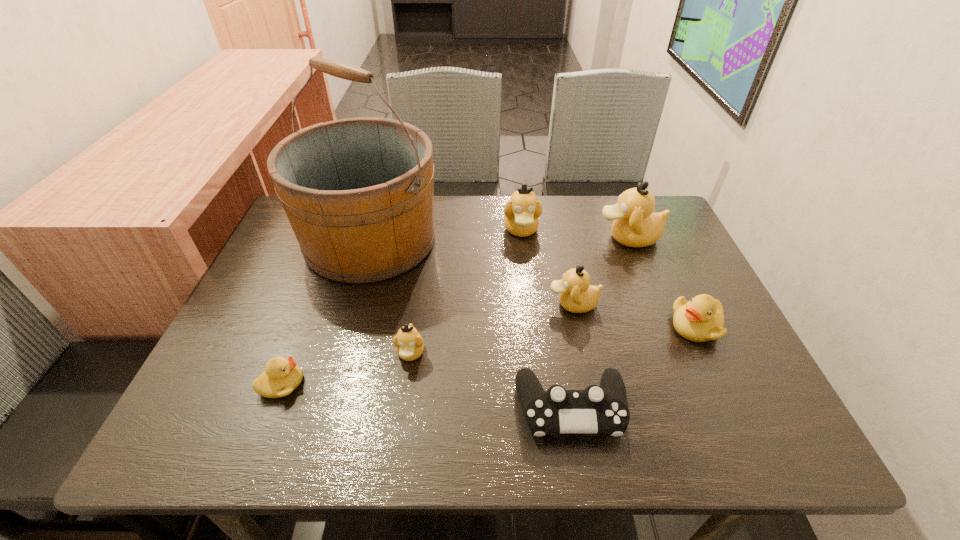
Where is `duckling that can be found as the second closest to the bigger yellow duckling`? The height and width of the screenshot is (540, 960). duckling that can be found as the second closest to the bigger yellow duckling is located at coordinates (635, 224).

Select which tan duckling appears as the closest to the second duckling from left to right. Please provide its 2D coordinates. Your answer should be formatted as a tuple, i.e. [(x, y)], where the tuple contains the x and y coordinates of a point satisfying the conditions above.

[(577, 295)]

Select which tan duckling is the fourth closest to the bigger yellow duckling. Please provide its 2D coordinates. Your answer should be formatted as a tuple, i.e. [(x, y)], where the tuple contains the x and y coordinates of a point satisfying the conditions above.

[(409, 344)]

Locate an element on the screen. This screenshot has height=540, width=960. vacant region that satisfies the following two spatial constraints: 1. on the face of the second smallest tan duckling; 2. on the face of the fifth duckling from right to left is located at coordinates (584, 353).

Locate an element on the screen. vacant space that satisfies the following two spatial constraints: 1. on the face of the rightmost tan duckling; 2. on the front side of the bucket is located at coordinates (630, 240).